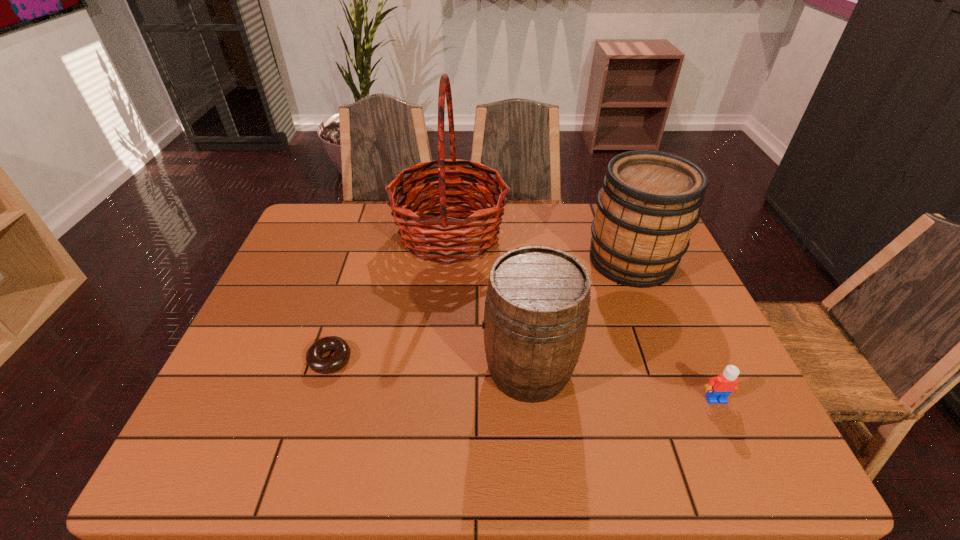
Locate an element on the screen. Image resolution: width=960 pixels, height=540 pixels. basket is located at coordinates (445, 244).

Where is `the farther cider`? the farther cider is located at coordinates (650, 201).

This screenshot has width=960, height=540. Identify the location of the left cider. (536, 312).

Where is `Lego`? Lego is located at coordinates (718, 389).

What are the coordinates of `the leftmost object` in the screenshot? It's located at (314, 359).

Where is `the shortest object`? The height and width of the screenshot is (540, 960). the shortest object is located at coordinates (314, 359).

I want to click on vacant region located 0.390m on the handle side of the basket, so click(633, 234).

Image resolution: width=960 pixels, height=540 pixels. I want to click on free location located 0.350m on the front of the farther cider, so [689, 406].

Where is `vacant area located on the side of the left cider near the bung hole`? Image resolution: width=960 pixels, height=540 pixels. vacant area located on the side of the left cider near the bung hole is located at coordinates (315, 369).

The height and width of the screenshot is (540, 960). Find the location of `vacant point located on the side of the left cider near the bung hole`. vacant point located on the side of the left cider near the bung hole is located at coordinates (429, 369).